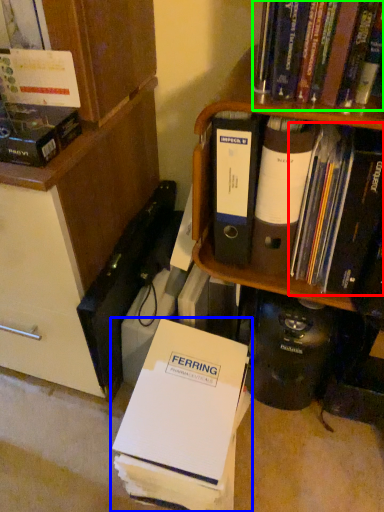
Question: Estimate the real-world distances between objects in this image. Which object is farther from book (highlighted by a red box), book (highlighted by a blue box) or book (highlighted by a green box)?

Choices:
 (A) book
 (B) book

Answer: (A)